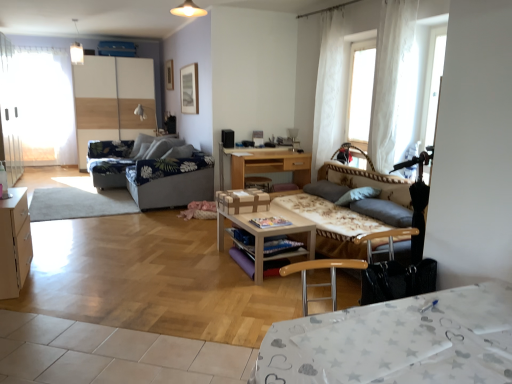
Question: From the image's perspective, is floral fabric studio couch at center, which is the 2th studio couch in back-to-front order, beneath white sheer curtain at upper right, placed as the second curtain when sorted from back to front?

Choices:
 (A) yes
 (B) no

Answer: (A)

Question: Is floral fabric studio couch at center, which appears as the 1th studio couch when viewed from the right, wider than white sheer curtain at upper right, placed as the second curtain when sorted from back to front?

Choices:
 (A) no
 (B) yes

Answer: (B)

Question: Is floral fabric studio couch at center, which is the 2th studio couch in back-to-front order, at the left side of white sheer curtain at upper right, placed as the 1th curtain when sorted from right to left?

Choices:
 (A) yes
 (B) no

Answer: (A)

Question: From a real-world perspective, is floral fabric studio couch at center, the 2th studio couch from the left, under white sheer curtain at upper right, placed as the second curtain when sorted from back to front?

Choices:
 (A) no
 (B) yes

Answer: (B)

Question: Is white sheer curtain at upper right, the first curtain in the front-to-back sequence, at the back of floral fabric studio couch at center, which appears as the 1th studio couch when viewed from the right?

Choices:
 (A) yes
 (B) no

Answer: (B)

Question: Choose the correct answer: Is white sheer curtain at upper right, the first curtain in the front-to-back sequence, inside white glossy dresser at left or outside it?

Choices:
 (A) outside
 (B) inside

Answer: (A)

Question: In the image, is white sheer curtain at upper right, placed as the second curtain when sorted from back to front, positioned in front of or behind white glossy dresser at left?

Choices:
 (A) behind
 (B) front

Answer: (B)

Question: From a real-world perspective, relative to white glossy dresser at left, is white sheer curtain at upper right, which is the 2th curtain in left-to-right order, vertically above or below?

Choices:
 (A) below
 (B) above

Answer: (B)

Question: Does point (378, 59) appear closer or farther from the camera than point (115, 102)?

Choices:
 (A) farther
 (B) closer

Answer: (B)

Question: Do you think white glossy dresser at left is within white sheer curtain at upper right, positioned as the second curtain in right-to-left order, or outside of it?

Choices:
 (A) outside
 (B) inside

Answer: (A)

Question: In terms of width, does white glossy dresser at left look wider or thinner when compared to white sheer curtain at upper right, which is the 1th curtain from back to front?

Choices:
 (A) thin
 (B) wide

Answer: (B)

Question: Considering their positions, is white glossy dresser at left located in front of or behind white sheer curtain at upper right, positioned as the second curtain in right-to-left order?

Choices:
 (A) behind
 (B) front

Answer: (A)

Question: From a real-world perspective, is white glossy dresser at left above or below white sheer curtain at upper right, the second curtain positioned from the front?

Choices:
 (A) above
 (B) below

Answer: (B)

Question: From a real-world perspective, is wooden desk at center, the 1th table in the top-to-bottom sequence, positioned above or below white sheer curtain at upper right, positioned as the second curtain in right-to-left order?

Choices:
 (A) above
 (B) below

Answer: (B)

Question: Visually, is wooden desk at center, the first table positioned from the back, positioned to the left or to the right of white sheer curtain at upper right, which is the 1th curtain from back to front?

Choices:
 (A) left
 (B) right

Answer: (A)